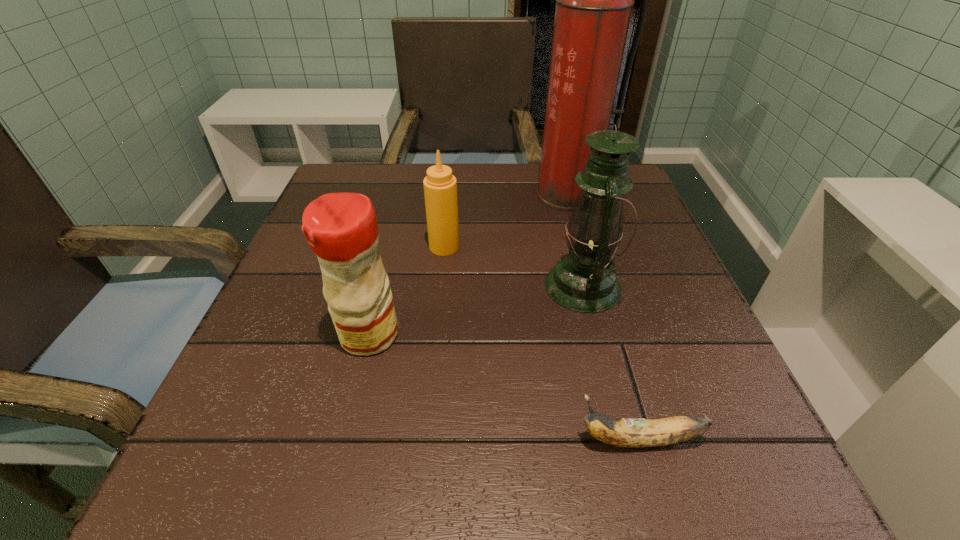
What are the coordinates of `oil lamp at the right edge` in the screenshot? It's located at (584, 280).

At what (x,y) coordinates should I click in order to perform the action: click on banana present at the right edge. Please return your answer as a coordinate pair (x, y). Looking at the image, I should click on (625, 432).

What are the coordinates of `object positioned at the far right corner` in the screenshot? It's located at (594, 0).

Where is `object situated at the near right corner`? object situated at the near right corner is located at coordinates 625,432.

At what (x,y) coordinates should I click in order to perform the action: click on free region at the far edge of the desktop. Please return your answer as a coordinate pair (x, y). Image resolution: width=960 pixels, height=540 pixels. Looking at the image, I should click on (426, 166).

The width and height of the screenshot is (960, 540). Identify the location of blank space at the near edge. 391,494.

Where is `free space at the left edge of the desktop`? The width and height of the screenshot is (960, 540). free space at the left edge of the desktop is located at coordinates (250, 373).

You are a GUI agent. You are given a task and a screenshot of the screen. Output one action in this format:
    pyautogui.click(x=<x>, y=<y>)
    Task: Click on the vacant region at the right edge of the desktop
    Image resolution: width=960 pixels, height=540 pixels.
    Given the screenshot: What is the action you would take?
    pyautogui.click(x=722, y=429)

I want to click on vacant space at the far left corner, so click(x=374, y=165).

You are a GUI agent. You are given a task and a screenshot of the screen. Output one action in this format:
    pyautogui.click(x=<x>, y=<y>)
    Task: Click on the vacant space at the near left corner
    
    Given the screenshot: What is the action you would take?
    pyautogui.click(x=283, y=468)